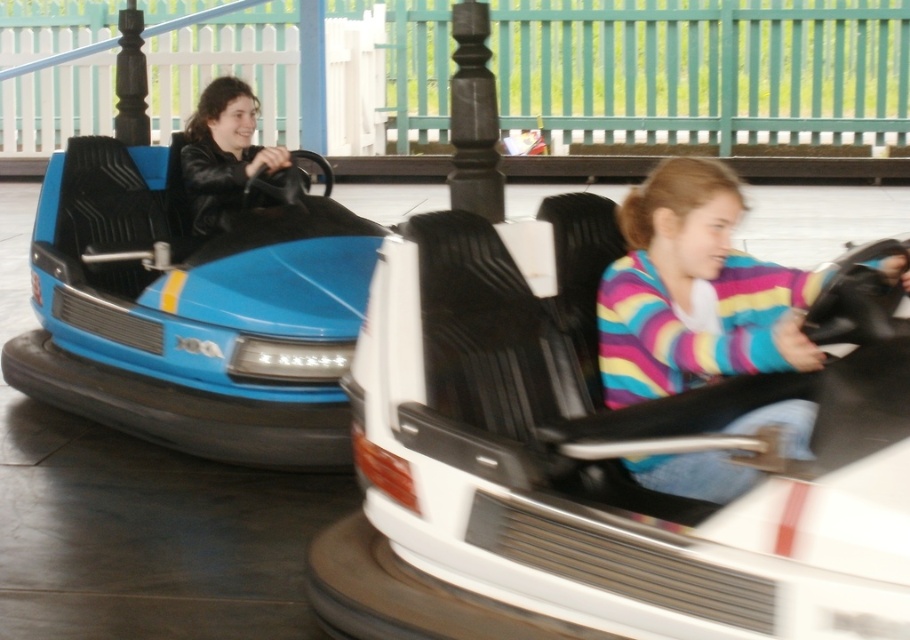
Is white glossy bumper car at center to the right of matte black jacket at left from the viewer's perspective?

Correct, you'll find white glossy bumper car at center to the right of matte black jacket at left.

Image resolution: width=910 pixels, height=640 pixels. In order to click on white glossy bumper car at center in this screenshot , I will do `click(602, 460)`.

Between point (560, 401) and point (248, 113), which one is positioned in front?

Point (560, 401) is in front.

At what (x,y) coordinates should I click in order to perform the action: click on white glossy bumper car at center. Please return your answer as a coordinate pair (x, y). Looking at the image, I should click on (602, 460).

This screenshot has width=910, height=640. In order to click on striped sweater at center in this screenshot , I will do `click(695, 291)`.

Which is behind, point (796, 502) or point (671, 228)?

The point (671, 228) is more distant.

Is point (464, 337) less distant than point (662, 195)?

No, it is not.

Is point (590, 602) behind point (715, 289)?

No.

At what (x,y) coordinates should I click in order to perform the action: click on white glossy bumper car at center. Please return your answer as a coordinate pair (x, y). Image resolution: width=910 pixels, height=640 pixels. Looking at the image, I should click on (602, 460).